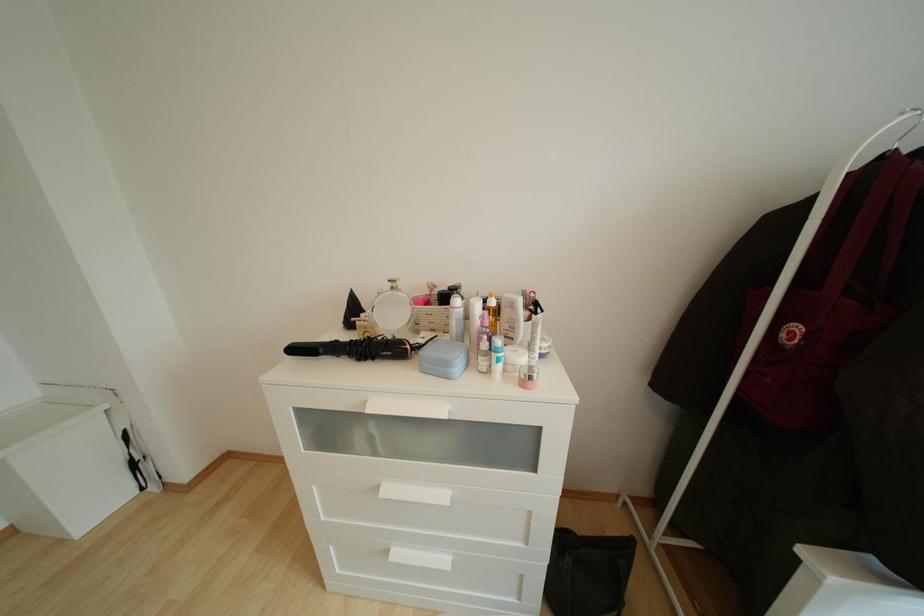
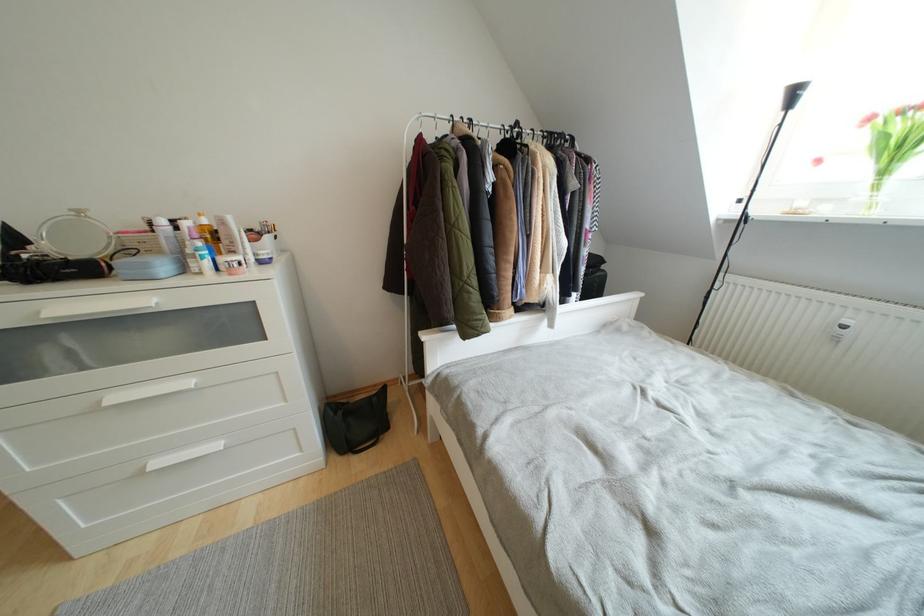
The point at (x=394, y=493) is marked in the first image. Where is the corresponding point in the second image?

(120, 402)